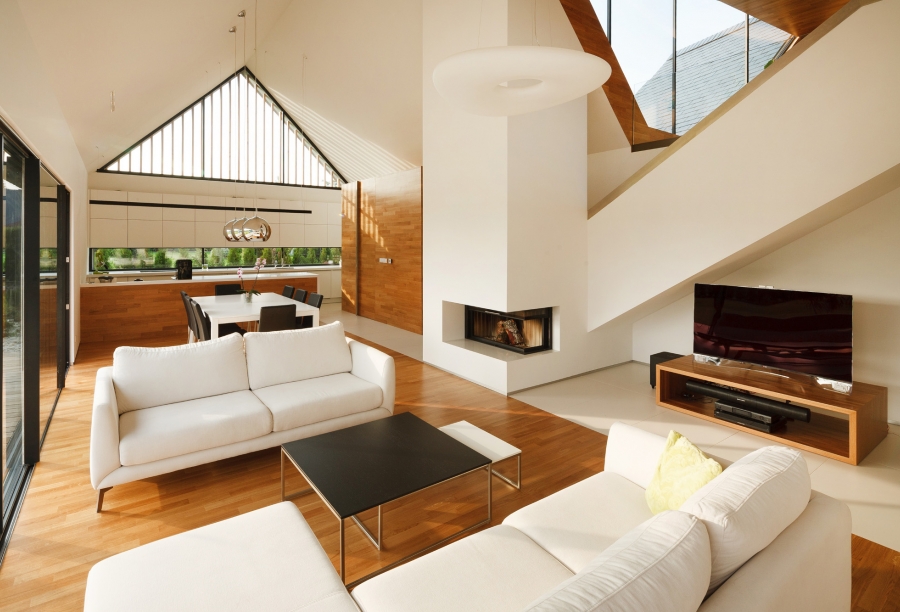
What are the coordinates of `couches` in the screenshot? It's located at (542, 586), (213, 414).